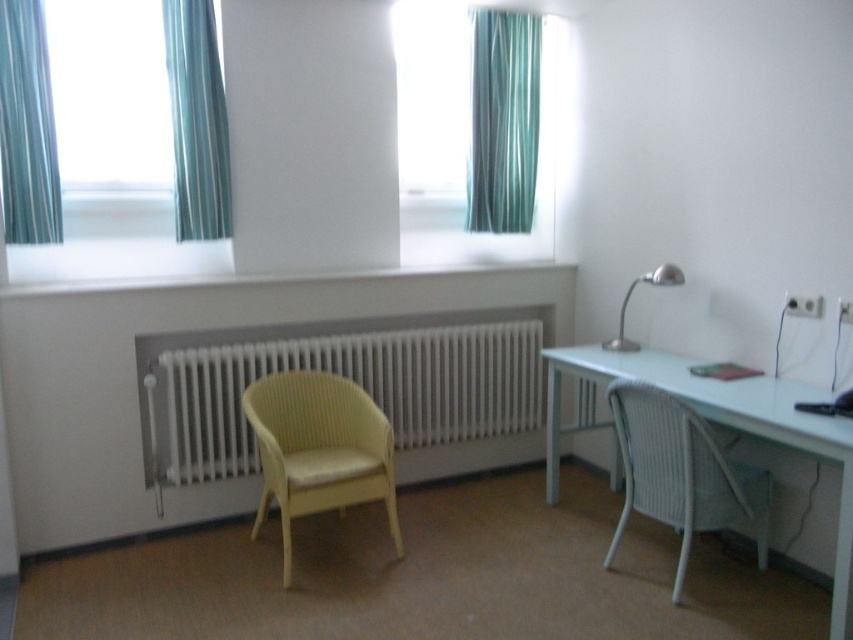
Between light blue plastic desk at lower right and satin silver desk lamp at right, which one is positioned lower?

light blue plastic desk at lower right

Which is above, light blue plastic desk at lower right or satin silver desk lamp at right?

Positioned higher is satin silver desk lamp at right.

Image resolution: width=853 pixels, height=640 pixels. Identify the location of light blue plastic desk at lower right. (724, 426).

Locate an element on the screen. light blue plastic desk at lower right is located at coordinates (724, 426).

Is glassy teal curtains at upper center wider than yellow wicker chair at center?

Correct, the width of glassy teal curtains at upper center exceeds that of yellow wicker chair at center.

Can you confirm if glassy teal curtains at upper center is positioned to the left of yellow wicker chair at center?

Yes, glassy teal curtains at upper center is to the left of yellow wicker chair at center.

Is point (323, 129) closer to viewer compared to point (390, 452)?

No, (323, 129) is behind (390, 452).

Where is `glassy teal curtains at upper center`? The image size is (853, 640). glassy teal curtains at upper center is located at coordinates (286, 145).

Between light blue plastic desk at lower right and green fabric curtain at upper left, which one has more height?

Standing taller between the two is green fabric curtain at upper left.

Who is positioned more to the left, light blue plastic desk at lower right or green fabric curtain at upper left?

green fabric curtain at upper left is more to the left.

Is point (560, 364) positioned after point (33, 173)?

Yes, it is.

In order to click on light blue plastic desk at lower right in this screenshot , I will do `click(724, 426)`.